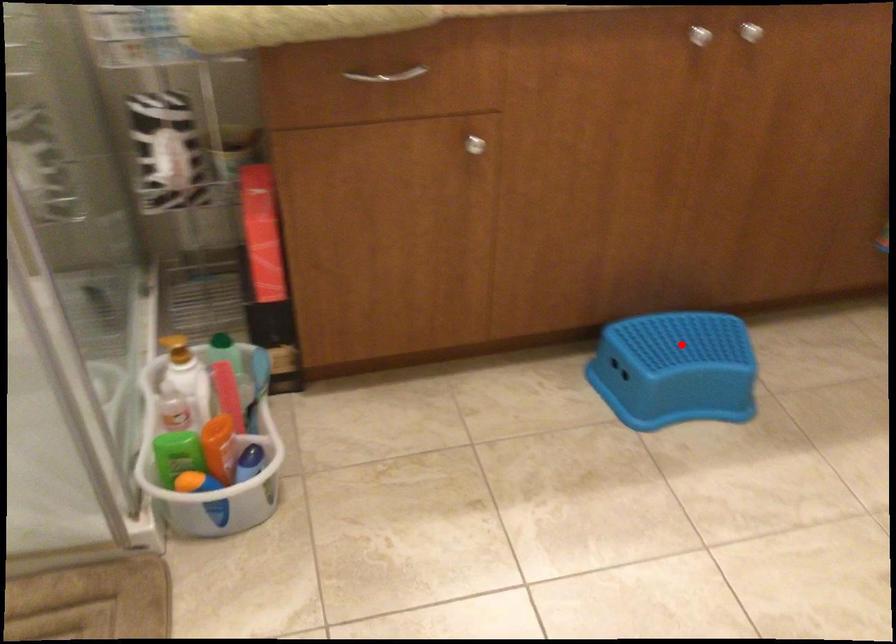
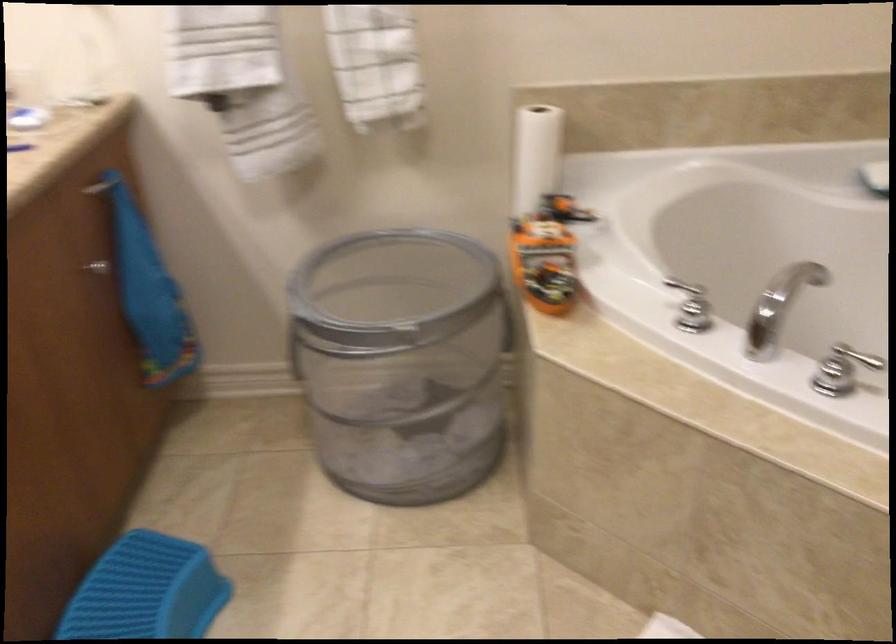
Find the pixel in the second image that matches the highlighted location in the first image.

(147, 591)